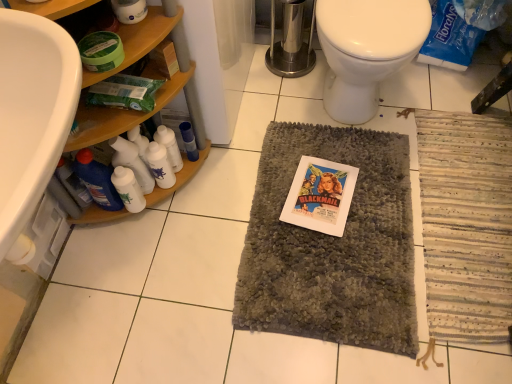
Locate an element on the screen. The height and width of the screenshot is (384, 512). vacant space that's between woodenshelves at left and striped fabric bath mat at lower right is located at coordinates (303, 232).